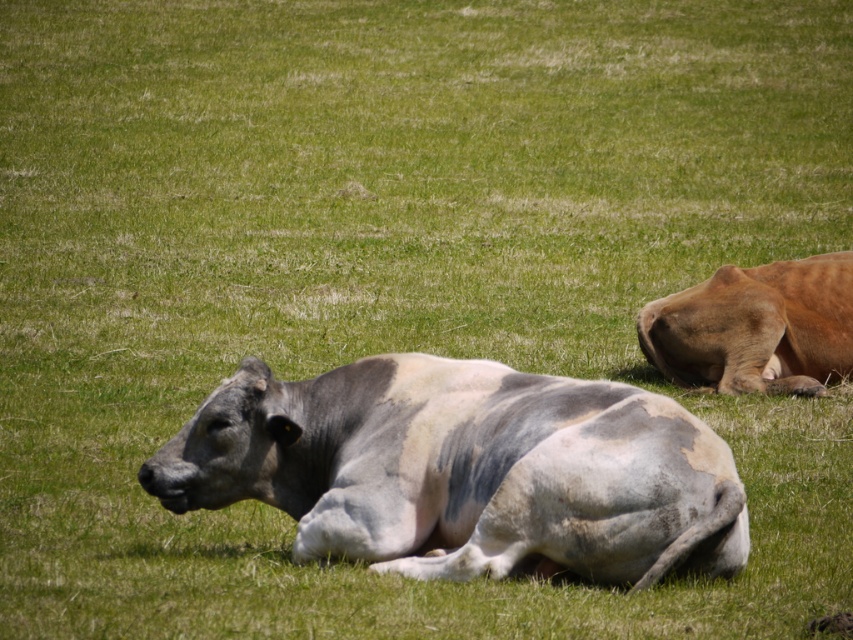
Question: Does speckled gray cow at center have a greater width compared to brown smooth cow at right?

Choices:
 (A) yes
 (B) no

Answer: (A)

Question: Is speckled gray cow at center further to the viewer compared to brown smooth cow at right?

Choices:
 (A) no
 (B) yes

Answer: (A)

Question: Which object is farther from the camera taking this photo?

Choices:
 (A) brown smooth cow at right
 (B) speckled gray cow at center

Answer: (A)

Question: Does speckled gray cow at center appear on the left side of brown smooth cow at right?

Choices:
 (A) yes
 (B) no

Answer: (A)

Question: Which point is closer to the camera?

Choices:
 (A) brown smooth cow at right
 (B) speckled gray cow at center

Answer: (B)

Question: Which of the following is the closest to the observer?

Choices:
 (A) (692, 330)
 (B) (421, 484)

Answer: (B)